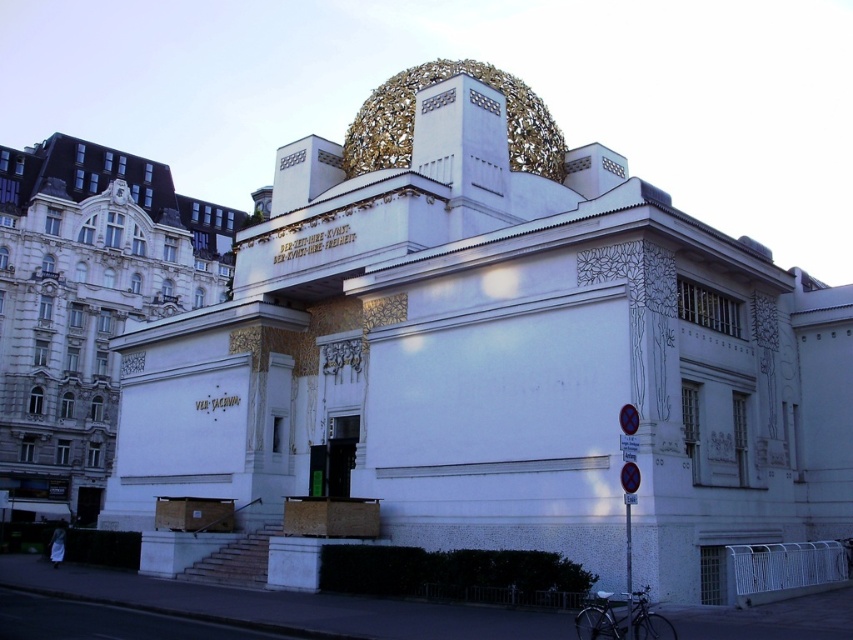
Question: Which object is closer to the camera taking this photo?

Choices:
 (A) silver metallic bicycle at lower right
 (B) white stone building at lower left
 (C) metallic pole at center

Answer: (A)

Question: Which of the following is the farthest from the observer?

Choices:
 (A) metallic pole at center
 (B) white stone building at lower left

Answer: (B)

Question: From the image, what is the correct spatial relationship of white stone building at lower left in relation to silver metallic bicycle at lower right?

Choices:
 (A) above
 (B) below

Answer: (A)

Question: Does white stone building at lower left come in front of metallic blue sign at lower right?

Choices:
 (A) no
 (B) yes

Answer: (A)

Question: Considering the real-world distances, which object is farthest from the metallic blue sign at lower right?

Choices:
 (A) silver metallic bicycle at lower right
 (B) white stone building at lower left
 (C) metallic pole at center

Answer: (B)

Question: From the image, what is the correct spatial relationship of silver metallic bicycle at lower right in relation to metallic pole at center?

Choices:
 (A) below
 (B) above

Answer: (A)